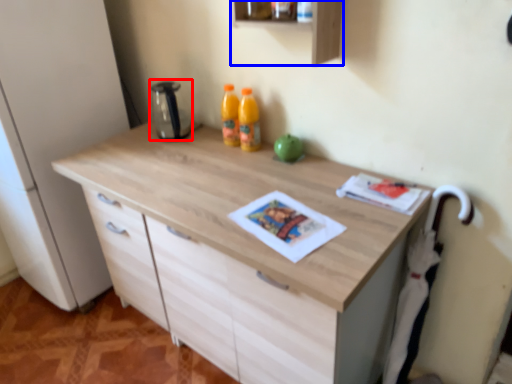
Question: Among these objects, which one is nearest to the camera, appliance (highlighted by a red box) or shelf (highlighted by a blue box)?

Choices:
 (A) appliance
 (B) shelf

Answer: (B)